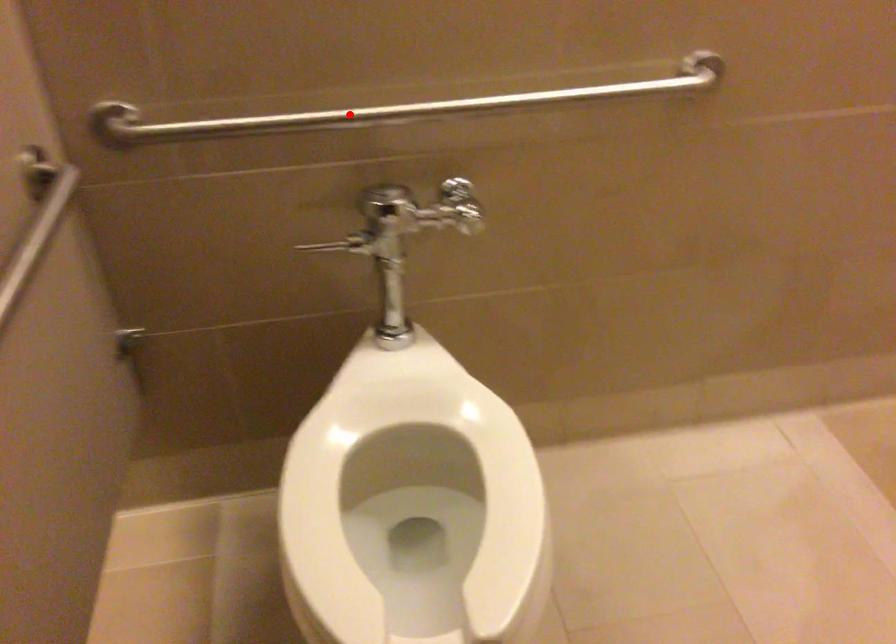
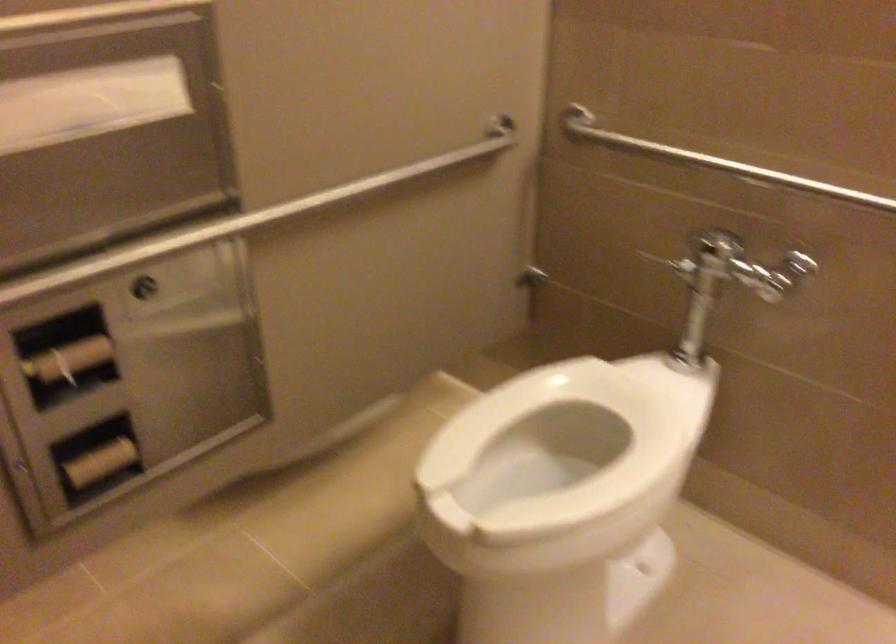
Find the pixel in the second image that matches the highlighted location in the first image.

(716, 162)